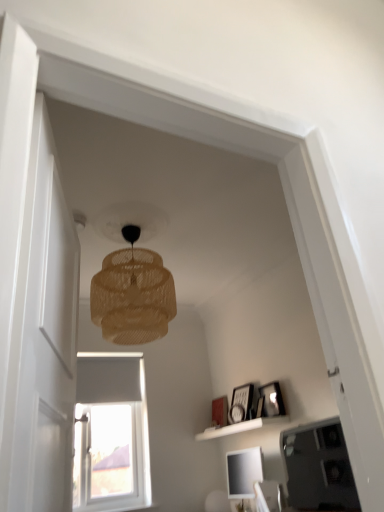
Question: From the image's perspective, is white matte shelf at lower center positioned above or below translucent woven lampshade at upper center?

Choices:
 (A) below
 (B) above

Answer: (A)

Question: Considering the positions of point (231, 425) and point (153, 333), is point (231, 425) closer or farther from the camera than point (153, 333)?

Choices:
 (A) farther
 (B) closer

Answer: (A)

Question: Which object is the farthest from the transparent glass door at left?

Choices:
 (A) wooden picture frame at upper right, placed as the 3th picture frame when sorted from back to front
 (B) white matte shelf at lower center
 (C) matte white picture frame at center, the first picture frame from the back
 (D) matte black picture frame at upper right, acting as the second picture frame starting from the front
 (E) translucent woven lampshade at upper center

Answer: (C)

Question: Estimate the real-world distances between objects in this image. Which object is farther from the translucent woven lampshade at upper center?

Choices:
 (A) white matte shelf at lower center
 (B) matte white picture frame at center, the first picture frame from the back
 (C) wooden picture frame at upper right, acting as the 3th picture frame starting from the left
 (D) transparent glass door at left
 (E) matte black picture frame at upper right, arranged as the 2th picture frame when viewed from the right

Answer: (B)